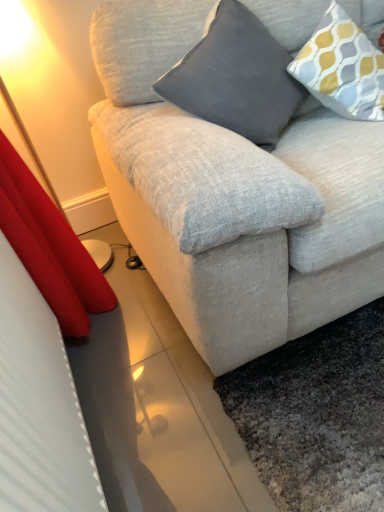
Question: From a real-world perspective, is gray fabric pillow at upper center, which is the 2th pillow in right-to-left order, under patterned fabric pillow at upper right, the 2th pillow positioned from the left?

Choices:
 (A) yes
 (B) no

Answer: (B)

Question: Could you tell me if gray fabric pillow at upper center, which is the 2th pillow in right-to-left order, is facing patterned fabric pillow at upper right, the 1th pillow positioned from the right?

Choices:
 (A) no
 (B) yes

Answer: (A)

Question: Is gray fabric pillow at upper center, positioned as the 1th pillow in left-to-right order, facing away from patterned fabric pillow at upper right, the 1th pillow positioned from the right?

Choices:
 (A) yes
 (B) no

Answer: (B)

Question: From the image's perspective, is gray fabric pillow at upper center, which is the 2th pillow in right-to-left order, over patterned fabric pillow at upper right, the 1th pillow positioned from the right?

Choices:
 (A) no
 (B) yes

Answer: (A)

Question: Does gray fabric pillow at upper center, which is the 2th pillow in right-to-left order, have a greater height compared to patterned fabric pillow at upper right, the 2th pillow positioned from the left?

Choices:
 (A) yes
 (B) no

Answer: (A)

Question: Does gray fabric pillow at upper center, positioned as the 1th pillow in left-to-right order, appear on the right side of patterned fabric pillow at upper right, the 2th pillow positioned from the left?

Choices:
 (A) no
 (B) yes

Answer: (A)

Question: Is patterned fabric pillow at upper right, the 2th pillow positioned from the left, positioned beyond the bounds of gray fabric pillow at upper center, positioned as the 1th pillow in left-to-right order?

Choices:
 (A) yes
 (B) no

Answer: (A)

Question: Considering the relative sizes of patterned fabric pillow at upper right, the 2th pillow positioned from the left, and gray fabric pillow at upper center, which is the 2th pillow in right-to-left order, in the image provided, is patterned fabric pillow at upper right, the 2th pillow positioned from the left, wider than gray fabric pillow at upper center, which is the 2th pillow in right-to-left order,?

Choices:
 (A) yes
 (B) no

Answer: (B)

Question: From the image's perspective, is patterned fabric pillow at upper right, the 1th pillow positioned from the right, located beneath gray fabric pillow at upper center, positioned as the 1th pillow in left-to-right order?

Choices:
 (A) no
 (B) yes

Answer: (A)

Question: Is patterned fabric pillow at upper right, the 1th pillow positioned from the right, positioned before gray fabric pillow at upper center, which is the 2th pillow in right-to-left order?

Choices:
 (A) no
 (B) yes

Answer: (A)

Question: Is patterned fabric pillow at upper right, the 2th pillow positioned from the left, directly adjacent to gray fabric pillow at upper center, which is the 2th pillow in right-to-left order?

Choices:
 (A) no
 (B) yes

Answer: (A)

Question: Considering the relative sizes of patterned fabric pillow at upper right, the 2th pillow positioned from the left, and gray fabric pillow at upper center, which is the 2th pillow in right-to-left order, in the image provided, is patterned fabric pillow at upper right, the 2th pillow positioned from the left, taller than gray fabric pillow at upper center, which is the 2th pillow in right-to-left order,?

Choices:
 (A) no
 (B) yes

Answer: (A)

Question: Is patterned fabric pillow at upper right, the 2th pillow positioned from the left, inside the boundaries of gray fabric pillow at upper center, positioned as the 1th pillow in left-to-right order, or outside?

Choices:
 (A) inside
 (B) outside

Answer: (B)